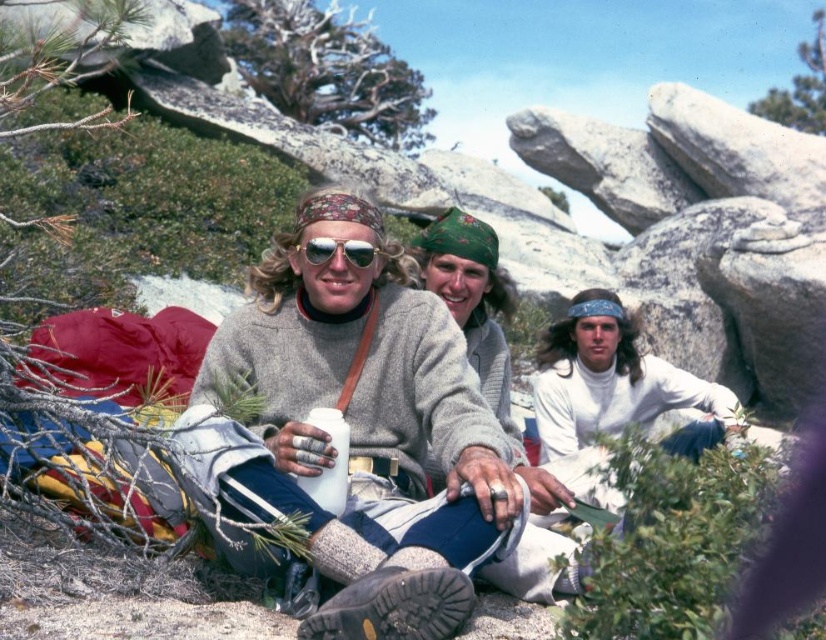
Question: Which object appears farthest from the camera in this image?

Choices:
 (A) knit sweater at center
 (B) matte silver goggles at center

Answer: (B)

Question: Considering the real-world distances, which object is closest to the knit sweater at center?

Choices:
 (A) matte silver goggles at center
 (B) white matte turtleneck at center

Answer: (A)

Question: Is the position of knit sweater at center less distant than that of white matte turtleneck at center?

Choices:
 (A) no
 (B) yes

Answer: (B)

Question: Does knit sweater at center have a smaller size compared to white matte turtleneck at center?

Choices:
 (A) yes
 (B) no

Answer: (B)

Question: Which point is closer to the camera?

Choices:
 (A) (544, 365)
 (B) (278, 301)

Answer: (B)

Question: Is white matte turtleneck at center thinner than matte silver goggles at center?

Choices:
 (A) no
 (B) yes

Answer: (A)